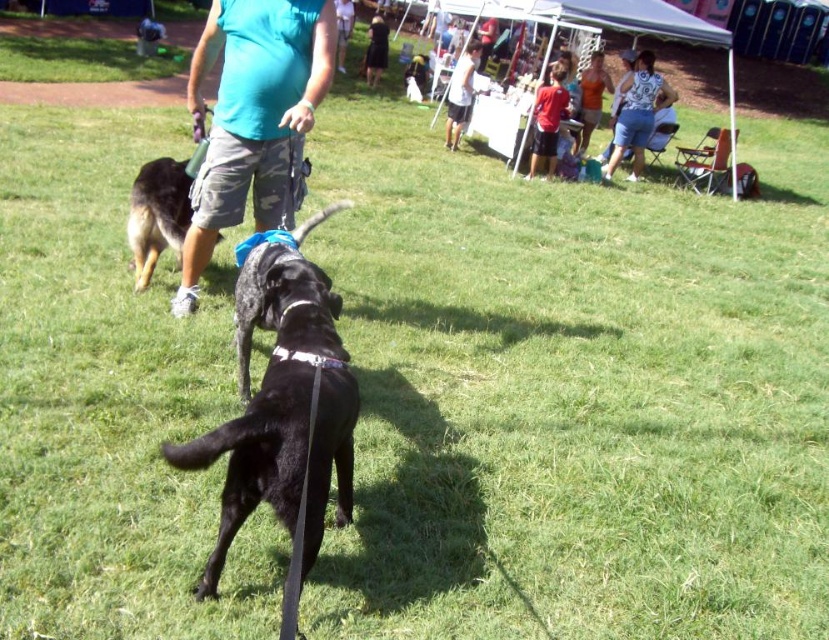
Does white cotton dress at upper right appear under black dress at center?

Yes.

Looking at this image, is white cotton dress at upper right taller than black dress at center?

Indeed, white cotton dress at upper right has a greater height compared to black dress at center.

This screenshot has width=829, height=640. What do you see at coordinates (638, 113) in the screenshot?
I see `white cotton dress at upper right` at bounding box center [638, 113].

Where is `white cotton dress at upper right`? This screenshot has width=829, height=640. white cotton dress at upper right is located at coordinates coord(638,113).

Can you confirm if black smooth dog at center is smaller than black dress at center?

Incorrect, black smooth dog at center is not smaller in size than black dress at center.

Can you confirm if black smooth dog at center is bigger than black dress at center?

Yes.

Is point (243, 276) farther from viewer compared to point (367, 45)?

That is False.

The width and height of the screenshot is (829, 640). I want to click on black smooth dog at center, so click(268, 284).

Does black smooth dog at center appear over black fur dog at center?

No.

Is point (245, 284) positioned behind point (173, 248)?

No, it is not.

Where is `black smooth dog at center`? This screenshot has width=829, height=640. black smooth dog at center is located at coordinates (268, 284).